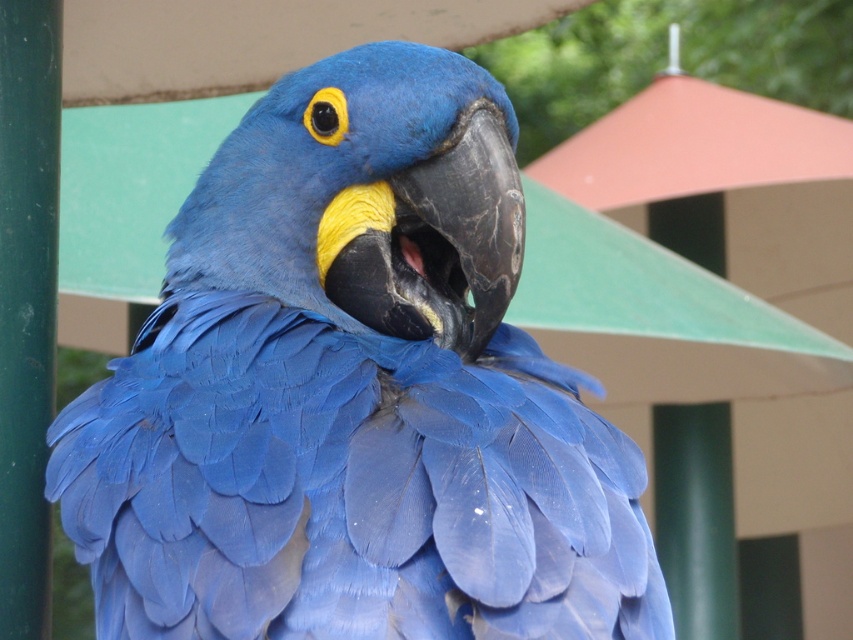
Question: Which point is closer to the camera?

Choices:
 (A) matte blue parrot at center
 (B) green matte pole at left

Answer: (A)

Question: Is matte blue parrot at center smaller than green matte pole at left?

Choices:
 (A) no
 (B) yes

Answer: (A)

Question: Is matte blue parrot at center below green matte pole at left?

Choices:
 (A) yes
 (B) no

Answer: (A)

Question: Which point is closer to the camera taking this photo?

Choices:
 (A) (1, 124)
 (B) (404, 244)

Answer: (A)

Question: Can you confirm if matte blue parrot at center is bigger than green matte pole at left?

Choices:
 (A) yes
 (B) no

Answer: (A)

Question: Which point appears farthest from the camera in this image?

Choices:
 (A) (22, 131)
 (B) (491, 333)

Answer: (A)